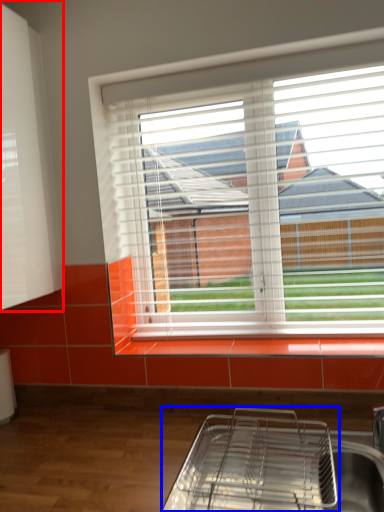
Question: Among these objects, which one is nearest to the camera, shutter (highlighted by a red box) or appliance (highlighted by a blue box)?

Choices:
 (A) shutter
 (B) appliance

Answer: (B)